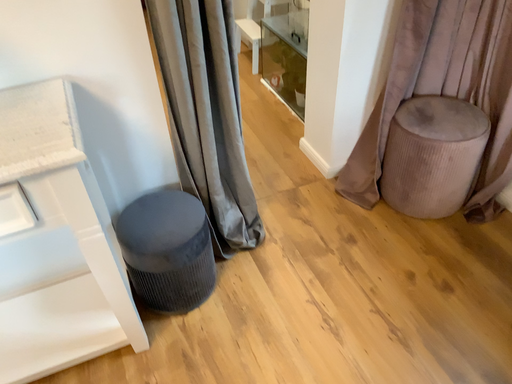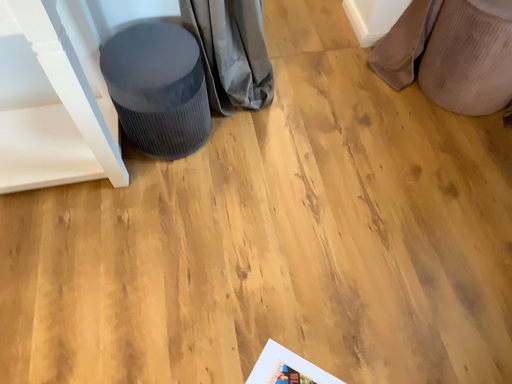
Question: How did the camera likely rotate when shooting the video?

Choices:
 (A) rotated left
 (B) rotated right

Answer: (A)